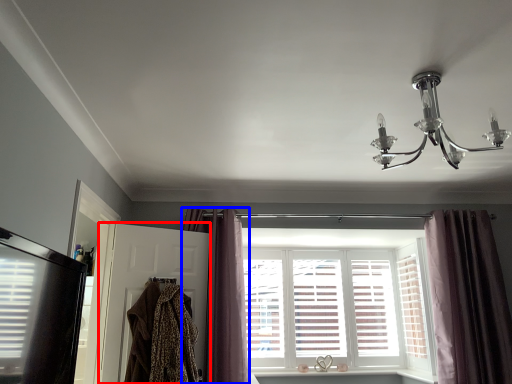
Question: Among these objects, which one is nearest to the camera, screen door (highlighted by a red box) or curtain (highlighted by a blue box)?

Choices:
 (A) screen door
 (B) curtain

Answer: (A)